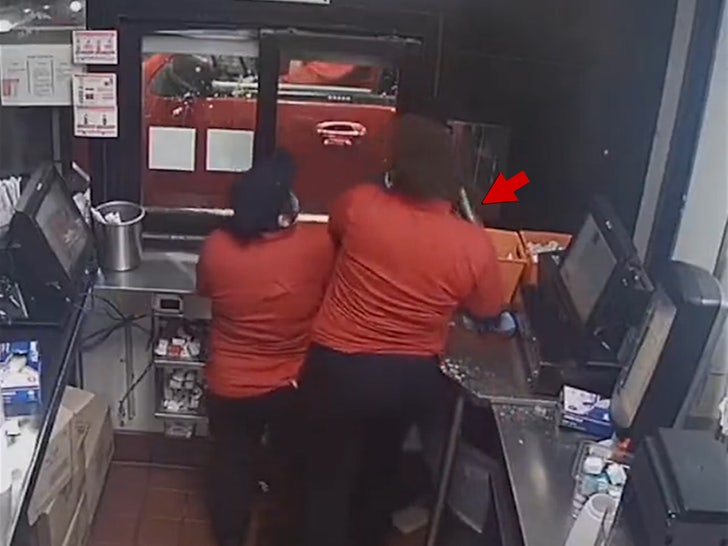
The width and height of the screenshot is (728, 546). In order to click on cash register in this screenshot , I will do (x=601, y=286).